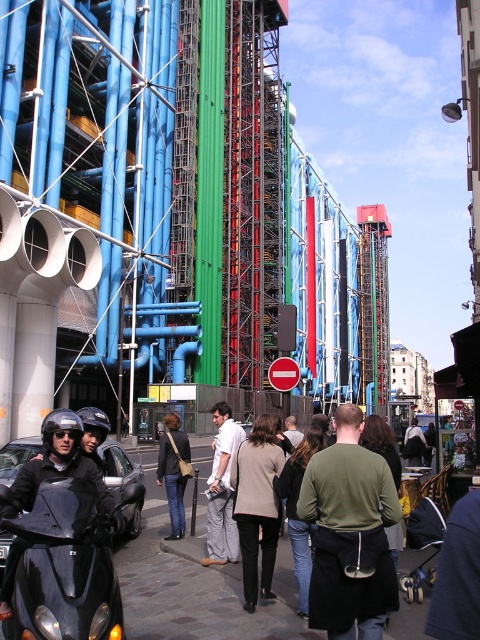
Question: Which point is farther to the camera?

Choices:
 (A) (211, 516)
 (B) (178, 477)
 (C) (337, 576)
 (D) (16, 548)

Answer: (B)

Question: Which object appears farthest from the camera in this image?

Choices:
 (A) green matte shirt at center
 (B) white cotton shirt at center

Answer: (B)

Question: Is green matte shirt at center to the right of denim jacket at center from the viewer's perspective?

Choices:
 (A) no
 (B) yes

Answer: (B)

Question: Which object is closer to the camera taking this photo?

Choices:
 (A) shiny black scooter at lower left
 (B) green matte shirt at center
 (C) denim jacket at center

Answer: (A)

Question: Does white cotton shirt at center come behind shiny black scooter at lower left?

Choices:
 (A) no
 (B) yes

Answer: (B)

Question: Does shiny black scooter at lower left have a smaller size compared to denim jacket at center?

Choices:
 (A) no
 (B) yes

Answer: (A)